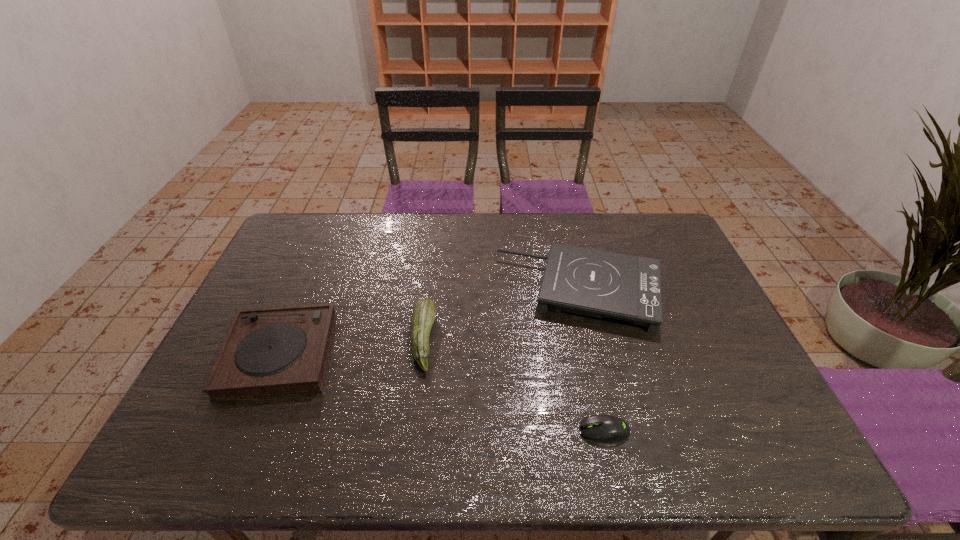
Where is `vacant region that satisfies the following two spatial constraints: 1. on the front side of the hotplate; 2. on the wheel side of the shortest object`? Image resolution: width=960 pixels, height=540 pixels. vacant region that satisfies the following two spatial constraints: 1. on the front side of the hotplate; 2. on the wheel side of the shortest object is located at coordinates (615, 430).